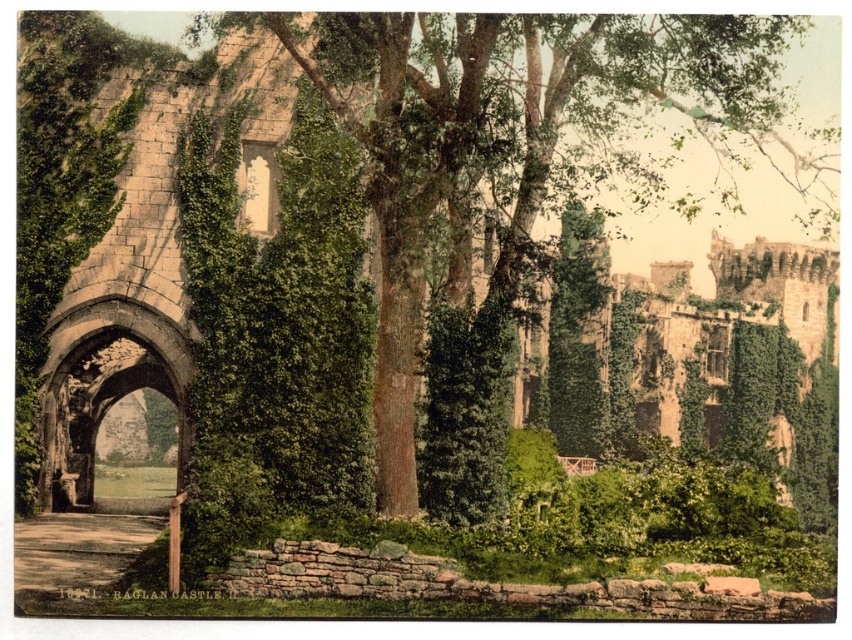
You are standing at the entrance of Raglan Castle, looking towards the green leafy tree at center. Based on its coordinates, can you estimate how far it is from your current position?

The green leafy tree at center is located at coordinates point [511,138], which means it is approximately 21.6 meters away horizontally and 60.1 meters away vertically from your current position at the entrance.

You are a visitor at Raglan Castle and want to take a photo that includes both the green leafy tree at center and the stone archway at center. Based on their sizes, which object will appear wider in your photo?

The green leafy tree at center will appear wider in the photo because its width is larger than that of the stone archway at center.

You are a tourist visiting Raglan Castle and want to take a photo of the green leafy tree at center from the smooth concrete path at lower left. Can you see the entire tree in your camera frame without moving your position?

The green leafy tree at center is above the smooth concrete path at lower left, so you can see the entire tree in your camera frame without moving your position because the tree is positioned above the path.